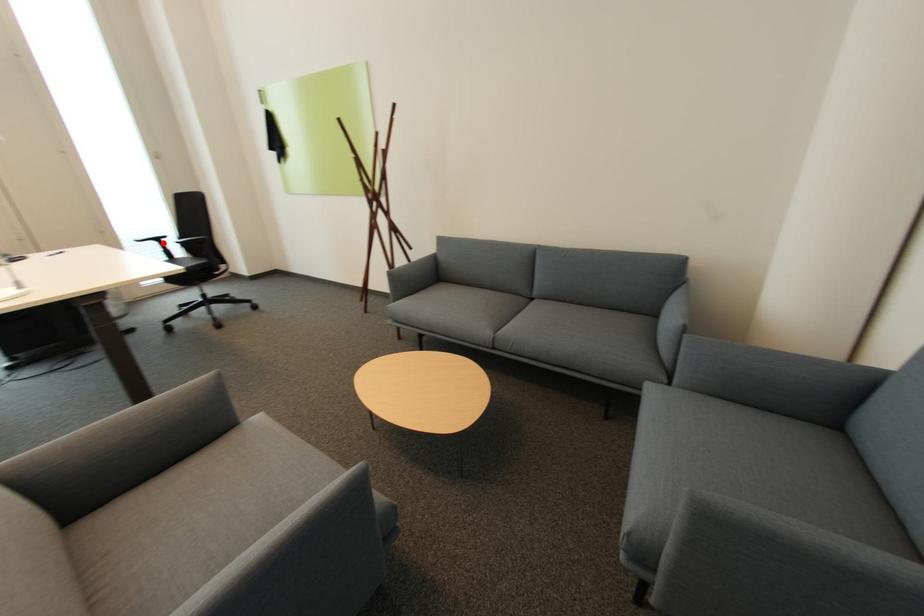
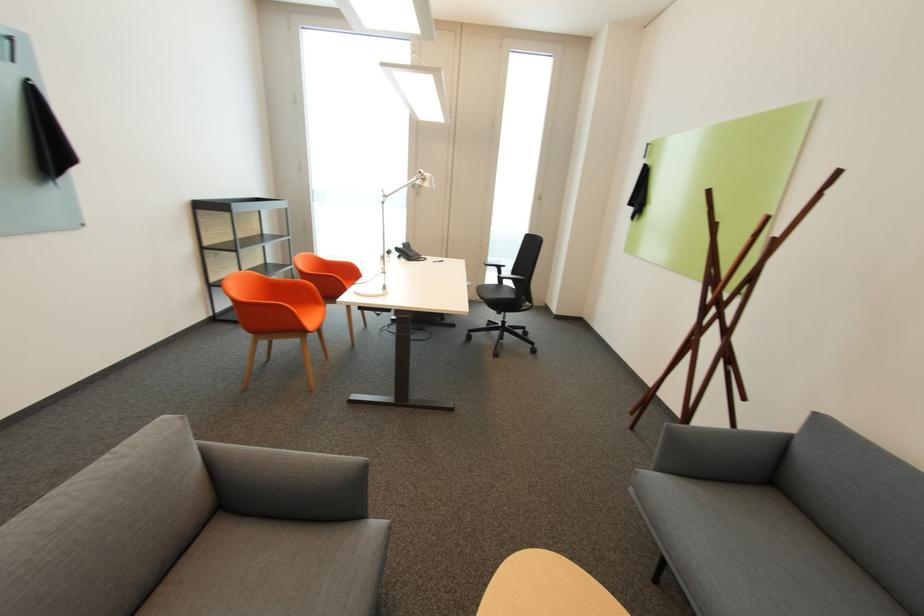
Question: I am providing you with two images of the same scene from different viewpoints. Image1 has a red point marked. In image2, the corresponding 3D location appears at what relative position? Reply with the corresponding letter.

Choices:
 (A) Closer
 (B) Farther

Answer: (A)